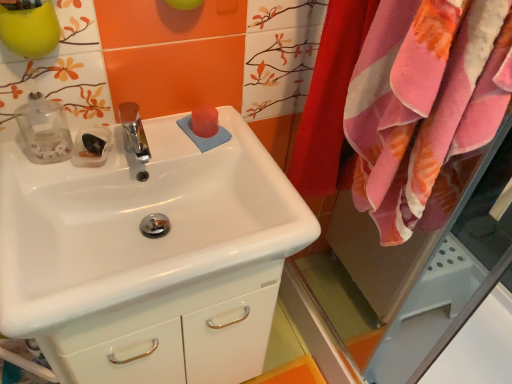
Question: Is white glossy sink at center facing away from pink plush towel at right?

Choices:
 (A) no
 (B) yes

Answer: (A)

Question: Is white glossy sink at center taller than pink plush towel at right?

Choices:
 (A) yes
 (B) no

Answer: (B)

Question: Are white glossy sink at center and pink plush towel at right far apart?

Choices:
 (A) no
 (B) yes

Answer: (A)

Question: Is white glossy sink at center not inside pink plush towel at right?

Choices:
 (A) yes
 (B) no

Answer: (A)

Question: Can you see white glossy sink at center touching pink plush towel at right?

Choices:
 (A) no
 (B) yes

Answer: (A)

Question: Does white glossy sink at center have a lesser height compared to pink plush towel at right?

Choices:
 (A) yes
 (B) no

Answer: (A)

Question: Can you confirm if white glossy sink at center is bigger than pink soft towel at right?

Choices:
 (A) yes
 (B) no

Answer: (A)

Question: Is white glossy sink at center looking in the opposite direction of pink soft towel at right?

Choices:
 (A) no
 (B) yes

Answer: (A)

Question: From the image's perspective, is white glossy sink at center located above pink soft towel at right?

Choices:
 (A) no
 (B) yes

Answer: (A)

Question: Is white glossy sink at center far away from pink soft towel at right?

Choices:
 (A) yes
 (B) no

Answer: (B)

Question: Considering the relative sizes of white glossy sink at center and pink soft towel at right in the image provided, is white glossy sink at center shorter than pink soft towel at right?

Choices:
 (A) yes
 (B) no

Answer: (A)

Question: Does white glossy sink at center have a smaller size compared to pink soft towel at right?

Choices:
 (A) yes
 (B) no

Answer: (B)

Question: Considering the relative sizes of pink plush towel at right and pink soft towel at right in the image provided, is pink plush towel at right wider than pink soft towel at right?

Choices:
 (A) yes
 (B) no

Answer: (B)